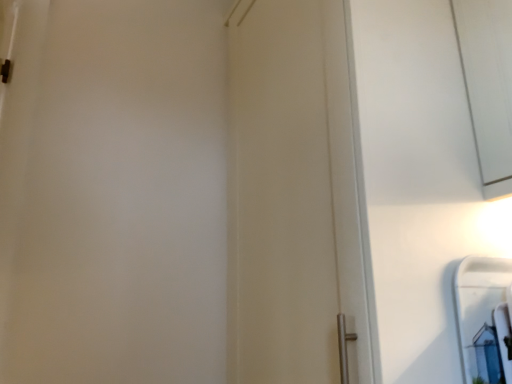
In order to click on white glossy door at upper right in this screenshot , I will do `click(296, 198)`.

The width and height of the screenshot is (512, 384). What do you see at coordinates (296, 198) in the screenshot? I see `white glossy door at upper right` at bounding box center [296, 198].

Find the location of a particular element. This screenshot has width=512, height=384. white glossy door at upper right is located at coordinates (296, 198).